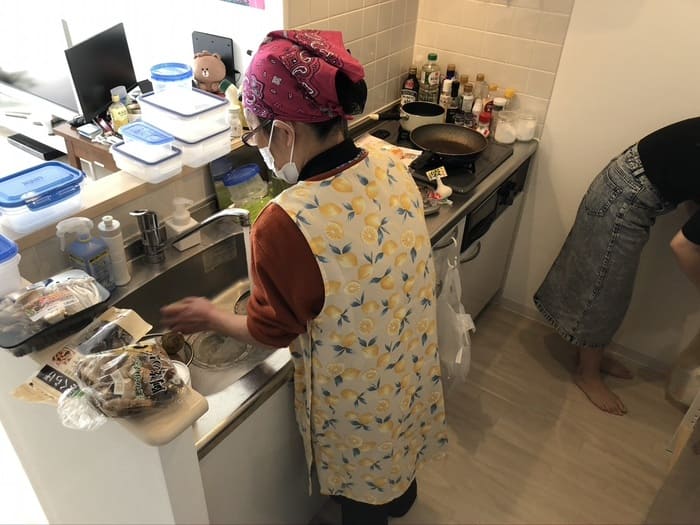
Where is `plushie`? plushie is located at coordinates (209, 72).